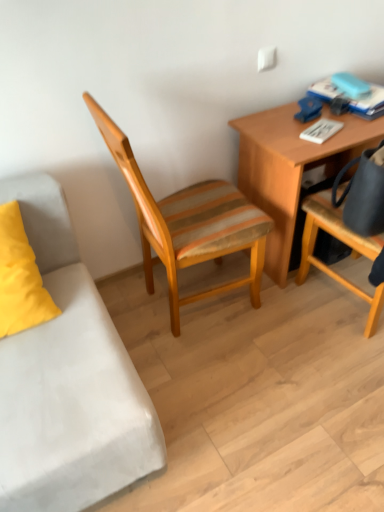
What are the coordinates of `vacant space in front of wooden desk at upper right` in the screenshot? It's located at (296, 338).